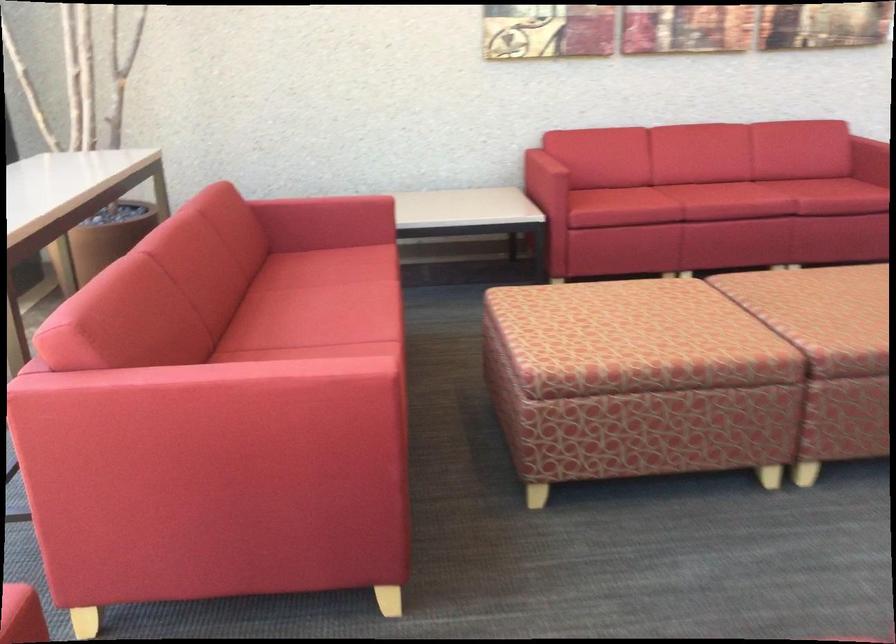
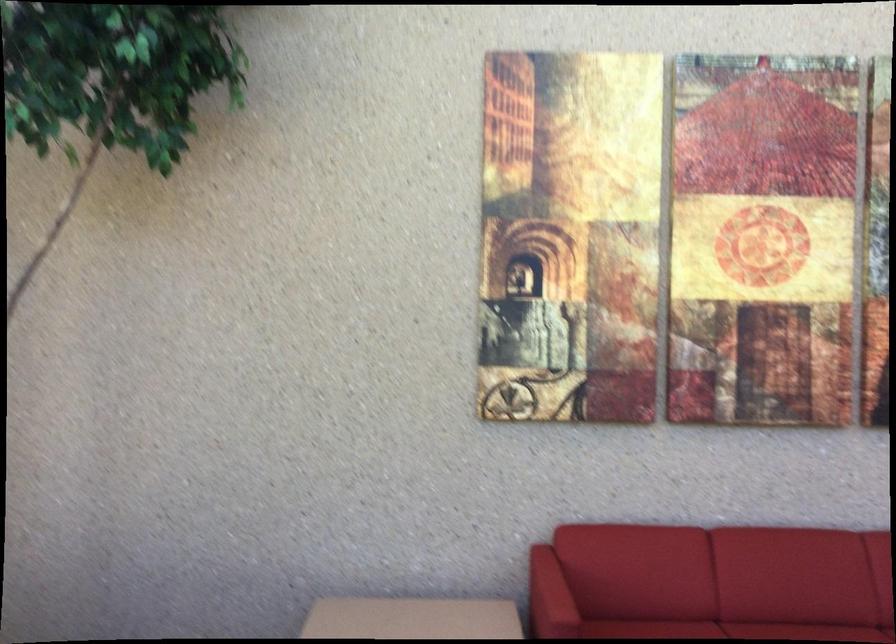
Find the pixel in the second image that matches (547,163) in the first image.

(549, 597)